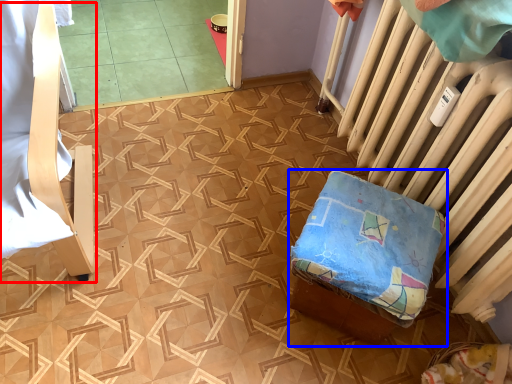
Question: Among these objects, which one is farthest to the camera, furniture (highlighted by a red box) or furniture (highlighted by a blue box)?

Choices:
 (A) furniture
 (B) furniture

Answer: (B)